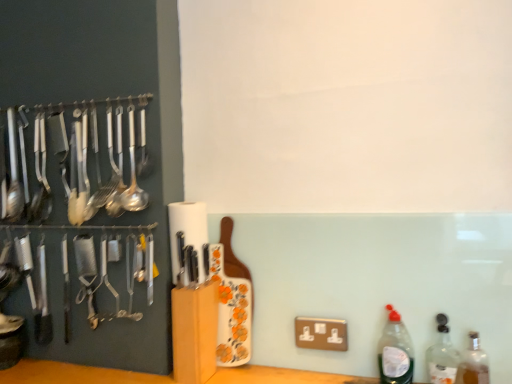
The image size is (512, 384). In order to click on polished silver spoon at left in this screenshot , I will do `click(70, 160)`.

At what (x,y) coordinates should I click in order to perform the action: click on clear glass bottle at right, placed as the 2th bottle when sorted from right to left. Please return your answer as a coordinate pair (x, y). The height and width of the screenshot is (384, 512). Looking at the image, I should click on (442, 355).

Describe the element at coordinates (395, 351) in the screenshot. The image size is (512, 384). I see `translucent plastic bottle at lower right, acting as the 1th bottle starting from the left` at that location.

Measure the distance between point (x=179, y=208) and camera.

They are 4.02 feet apart.

The height and width of the screenshot is (384, 512). What do you see at coordinates (473, 364) in the screenshot?
I see `translucent glass bottle at lower right, marked as the 1th bottle in a right-to-left arrangement` at bounding box center [473, 364].

Where is `polished silver spoon at left`? The image size is (512, 384). polished silver spoon at left is located at coordinates (70, 160).

Consider the image. Considering the relative positions of translucent glass bottle at lower right, marked as the 1th bottle in a right-to-left arrangement, and polished silver spoon at left in the image provided, is translucent glass bottle at lower right, marked as the 1th bottle in a right-to-left arrangement, to the left of polished silver spoon at left from the viewer's perspective?

No.

From their relative heights in the image, would you say translucent glass bottle at lower right, marked as the 1th bottle in a right-to-left arrangement, is taller or shorter than polished silver spoon at left?

translucent glass bottle at lower right, marked as the 1th bottle in a right-to-left arrangement, is shorter than polished silver spoon at left.

Is translucent glass bottle at lower right, marked as the 1th bottle in a right-to-left arrangement, oriented away from polished silver spoon at left?

No, translucent glass bottle at lower right, marked as the 1th bottle in a right-to-left arrangement,'s orientation is not away from polished silver spoon at left.

Which is behind, point (471, 352) or point (24, 149)?

The point (24, 149) is farther from the camera.

From a real-world perspective, who is located higher, translucent glass bottle at lower right, the 3th bottle from the left, or translucent plastic bottle at lower right, acting as the 1th bottle starting from the left?

translucent plastic bottle at lower right, acting as the 1th bottle starting from the left.

Between translucent glass bottle at lower right, marked as the 1th bottle in a right-to-left arrangement, and translucent plastic bottle at lower right, which is the third bottle in right-to-left order, which one is positioned behind?

translucent plastic bottle at lower right, which is the third bottle in right-to-left order, is more distant.

From the translucent plastic bottle at lower right, acting as the 1th bottle starting from the left, count 2nd bottle to the right and point to it. Please provide its 2D coordinates.

[(473, 364)]

Can you see translucent glass bottle at lower right, marked as the 1th bottle in a right-to-left arrangement, touching translucent plastic bottle at lower right, acting as the 1th bottle starting from the left?

No, translucent glass bottle at lower right, marked as the 1th bottle in a right-to-left arrangement, is not in contact with translucent plastic bottle at lower right, acting as the 1th bottle starting from the left.

Is clear glass bottle at right, placed as the second bottle when sorted from left to right, facing away from translucent plastic bottle at lower right, which is the third bottle in right-to-left order?

No, clear glass bottle at right, placed as the second bottle when sorted from left to right,'s orientation is not away from translucent plastic bottle at lower right, which is the third bottle in right-to-left order.

Can you confirm if clear glass bottle at right, placed as the second bottle when sorted from left to right, is smaller than translucent plastic bottle at lower right, acting as the 1th bottle starting from the left?

Correct, clear glass bottle at right, placed as the second bottle when sorted from left to right, occupies less space than translucent plastic bottle at lower right, acting as the 1th bottle starting from the left.

From the image's perspective, is clear glass bottle at right, placed as the 2th bottle when sorted from right to left, located above or below translucent plastic bottle at lower right, acting as the 1th bottle starting from the left?

Clearly, from the image's perspective, clear glass bottle at right, placed as the 2th bottle when sorted from right to left, is below translucent plastic bottle at lower right, acting as the 1th bottle starting from the left.

From the picture: Does polished silver spoon at left have a greater height compared to clear glass bottle at right, placed as the second bottle when sorted from left to right?

Yes.

How much distance is there between polished silver spoon at left and clear glass bottle at right, placed as the second bottle when sorted from left to right?

A distance of 3.68 feet exists between polished silver spoon at left and clear glass bottle at right, placed as the second bottle when sorted from left to right.

From a real-world perspective, is polished silver spoon at left physically located above or below clear glass bottle at right, placed as the 2th bottle when sorted from right to left?

Clearly, from a real-world perspective, polished silver spoon at left is above clear glass bottle at right, placed as the 2th bottle when sorted from right to left.

Locate an element on the screen. The image size is (512, 384). spoon on the left of the clear glass bottle at right, placed as the second bottle when sorted from left to right is located at coordinates (70, 160).

Could you measure the distance between translucent plastic bottle at lower right, acting as the 1th bottle starting from the left, and translucent glass bottle at lower right, marked as the 1th bottle in a right-to-left arrangement?

A distance of 5.89 inches exists between translucent plastic bottle at lower right, acting as the 1th bottle starting from the left, and translucent glass bottle at lower right, marked as the 1th bottle in a right-to-left arrangement.

Considering the relative sizes of translucent plastic bottle at lower right, acting as the 1th bottle starting from the left, and translucent glass bottle at lower right, marked as the 1th bottle in a right-to-left arrangement, in the image provided, is translucent plastic bottle at lower right, acting as the 1th bottle starting from the left, bigger than translucent glass bottle at lower right, marked as the 1th bottle in a right-to-left arrangement,?

Correct, translucent plastic bottle at lower right, acting as the 1th bottle starting from the left, is larger in size than translucent glass bottle at lower right, marked as the 1th bottle in a right-to-left arrangement.

Is point (410, 342) closer to viewer compared to point (475, 345)?

No, (410, 342) is further to viewer.

From the image's perspective, is translucent plastic bottle at lower right, acting as the 1th bottle starting from the left, under translucent glass bottle at lower right, marked as the 1th bottle in a right-to-left arrangement?

No, from the image's perspective, translucent plastic bottle at lower right, acting as the 1th bottle starting from the left, is not below translucent glass bottle at lower right, marked as the 1th bottle in a right-to-left arrangement.

Is polished silver spoon at left further to the viewer compared to white matte paper towel at center?

No.

Is polished silver spoon at left far away from white matte paper towel at center?

No, there isn't a large distance between polished silver spoon at left and white matte paper towel at center.

Is polished silver spoon at left surrounding white matte paper towel at center?

No, white matte paper towel at center is not inside polished silver spoon at left.

Considering their positions, is polished silver spoon at left located in front of or behind translucent glass bottle at lower right, marked as the 1th bottle in a right-to-left arrangement?

Visually, polished silver spoon at left is located behind translucent glass bottle at lower right, marked as the 1th bottle in a right-to-left arrangement.

Who is bigger, polished silver spoon at left or translucent glass bottle at lower right, the 3th bottle from the left?

polished silver spoon at left is bigger.

Is polished silver spoon at left wider or thinner than translucent glass bottle at lower right, the 3th bottle from the left?

In the image, polished silver spoon at left appears to be wider than translucent glass bottle at lower right, the 3th bottle from the left.

What are the coordinates of `spoon above the translucent glass bottle at lower right, the 3th bottle from the left (from the image's perspective)` in the screenshot? It's located at (70, 160).

From a real-world perspective, starting from the translucent plastic bottle at lower right, which is the third bottle in right-to-left order, which bottle is the 2nd one below it? Please provide its 2D coordinates.

[(473, 364)]

From the image, which object appears to be nearer to white matte paper towel at center, polished silver spoon at left or clear glass bottle at right, placed as the second bottle when sorted from left to right?

Based on the image, polished silver spoon at left appears to be nearer to white matte paper towel at center.

When comparing their distances from clear glass bottle at right, placed as the 2th bottle when sorted from right to left, does polished silver spoon at left or white matte paper towel at center seem closer?

Among the two, white matte paper towel at center is located nearer to clear glass bottle at right, placed as the 2th bottle when sorted from right to left.

When comparing their distances from white matte paper towel at center, does translucent plastic bottle at lower right, which is the third bottle in right-to-left order, or clear glass bottle at right, placed as the second bottle when sorted from left to right, seem closer?

Among the two, translucent plastic bottle at lower right, which is the third bottle in right-to-left order, is located nearer to white matte paper towel at center.

Looking at the image, which one is located further to white matte paper towel at center, clear glass bottle at right, placed as the second bottle when sorted from left to right, or translucent glass bottle at lower right, the 3th bottle from the left?

Among the two, translucent glass bottle at lower right, the 3th bottle from the left, is located further to white matte paper towel at center.

Based on their spatial positions, is translucent plastic bottle at lower right, acting as the 1th bottle starting from the left, or translucent glass bottle at lower right, the 3th bottle from the left, closer to polished silver spoon at left?

Based on the image, translucent plastic bottle at lower right, acting as the 1th bottle starting from the left, appears to be nearer to polished silver spoon at left.

Based on their spatial positions, is polished silver spoon at left or clear glass bottle at right, placed as the second bottle when sorted from left to right, further from translucent plastic bottle at lower right, acting as the 1th bottle starting from the left?

The object further to translucent plastic bottle at lower right, acting as the 1th bottle starting from the left, is polished silver spoon at left.

Based on their spatial positions, is white matte paper towel at center or translucent glass bottle at lower right, the 3th bottle from the left, closer to clear glass bottle at right, placed as the 2th bottle when sorted from right to left?

translucent glass bottle at lower right, the 3th bottle from the left, lies closer to clear glass bottle at right, placed as the 2th bottle when sorted from right to left, than the other object.

Estimate the real-world distances between objects in this image. Which object is further from translucent glass bottle at lower right, the 3th bottle from the left, translucent plastic bottle at lower right, acting as the 1th bottle starting from the left, or clear glass bottle at right, placed as the second bottle when sorted from left to right?

Among the two, translucent plastic bottle at lower right, acting as the 1th bottle starting from the left, is located further to translucent glass bottle at lower right, the 3th bottle from the left.

Find the location of `paper towel between polished silver spoon at left and clear glass bottle at right, placed as the second bottle when sorted from left to right, from left to right`. paper towel between polished silver spoon at left and clear glass bottle at right, placed as the second bottle when sorted from left to right, from left to right is located at coordinates (188, 231).

At what (x,y) coordinates should I click in order to perform the action: click on bottle between translucent plastic bottle at lower right, acting as the 1th bottle starting from the left, and translucent glass bottle at lower right, the 3th bottle from the left, from left to right. Please return your answer as a coordinate pair (x, y). This screenshot has height=384, width=512. Looking at the image, I should click on coord(442,355).

Locate an element on the screen. The height and width of the screenshot is (384, 512). bottle located between polished silver spoon at left and clear glass bottle at right, placed as the 2th bottle when sorted from right to left, in the left-right direction is located at coordinates (395, 351).

Image resolution: width=512 pixels, height=384 pixels. In order to click on bottle between white matte paper towel at center and clear glass bottle at right, placed as the 2th bottle when sorted from right to left, from left to right in this screenshot , I will do `click(395, 351)`.